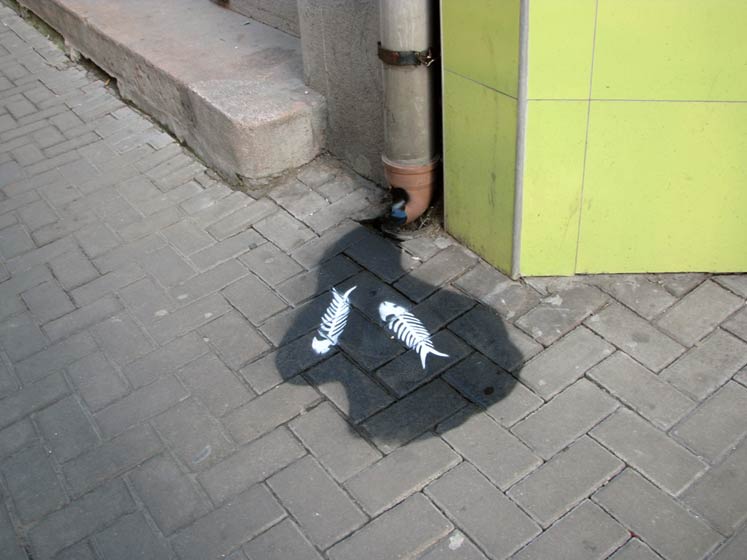
The height and width of the screenshot is (560, 747). Find the location of `empty space between pathway and step`. empty space between pathway and step is located at coordinates (87, 60).